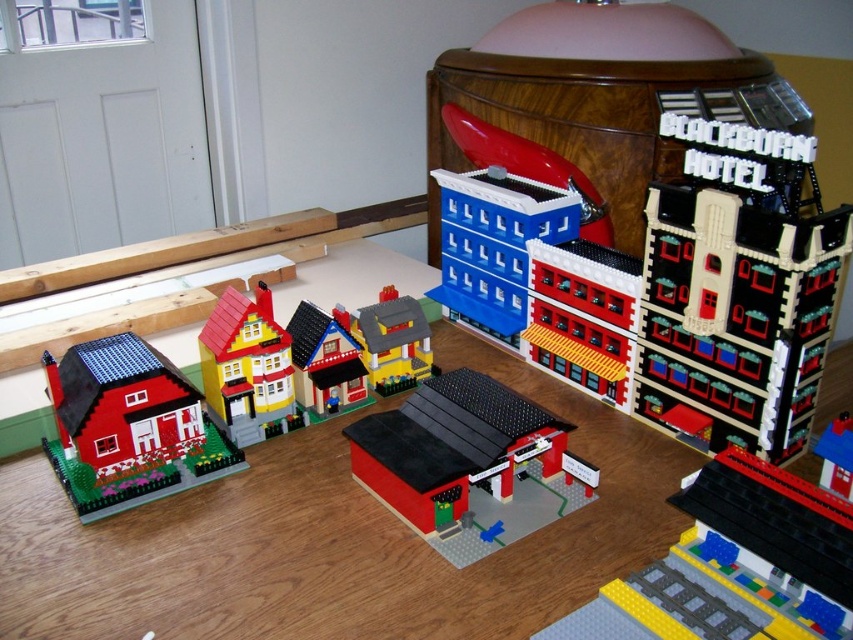
You are a toy car that is 3 inches long. You are placed on the yellow matte road at lower center. Can you drive straight ahead without falling off the road?

The yellow matte road at lower center is 28.45 inches away from the viewer, so yes, the toy car can drive straight ahead without falling off the road since it is long enough to accommodate the car.

You are looking at the LEGO structures on the table. There are two points marked in the image. The first point is at coordinates point (265, 316) and the second is at point (375, 378). Which point is closer to you?

Point (265, 316) is closer to the viewer than point (375, 378).